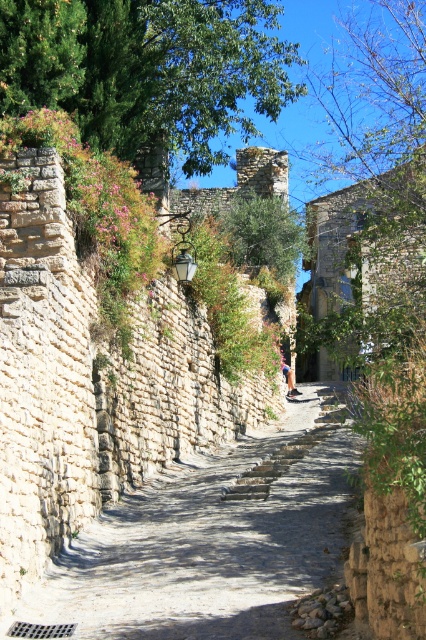
Between smooth stone path at center and green leafy tree at upper left, which one appears on the right side from the viewer's perspective?

From the viewer's perspective, smooth stone path at center appears more on the right side.

Measure the distance between smooth stone path at center and camera.

smooth stone path at center and camera are 32.38 meters apart from each other.

This screenshot has width=426, height=640. What are the coordinates of `smooth stone path at center` in the screenshot? It's located at click(212, 540).